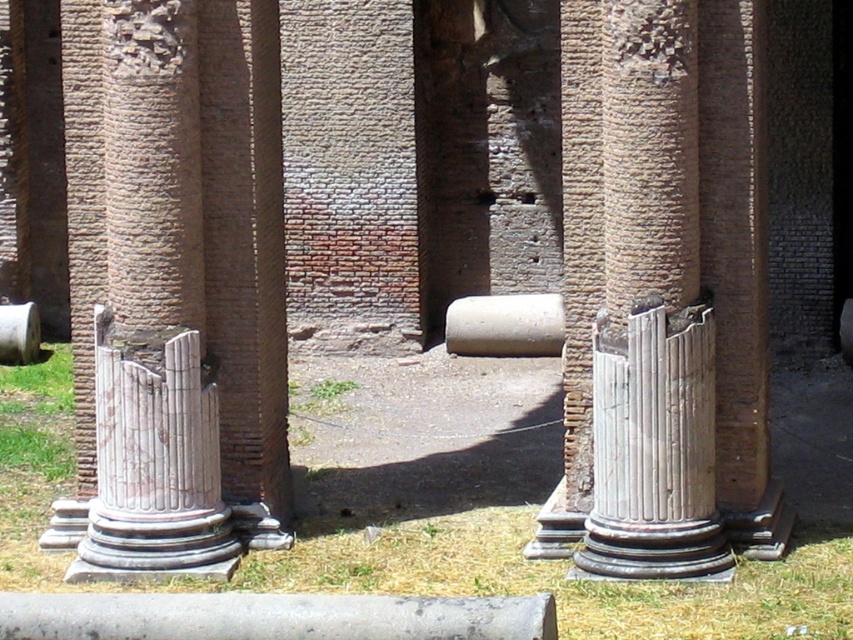
Who is lower down, white marble column at center or white marble column at left?

white marble column at left

Is white marble column at center in front of white marble column at left?

Yes, white marble column at center is closer to the viewer.

Who is more forward, [624,301] or [132,26]?

Point [132,26]

Identify the location of white marble column at center. The width and height of the screenshot is (853, 640). (648, 316).